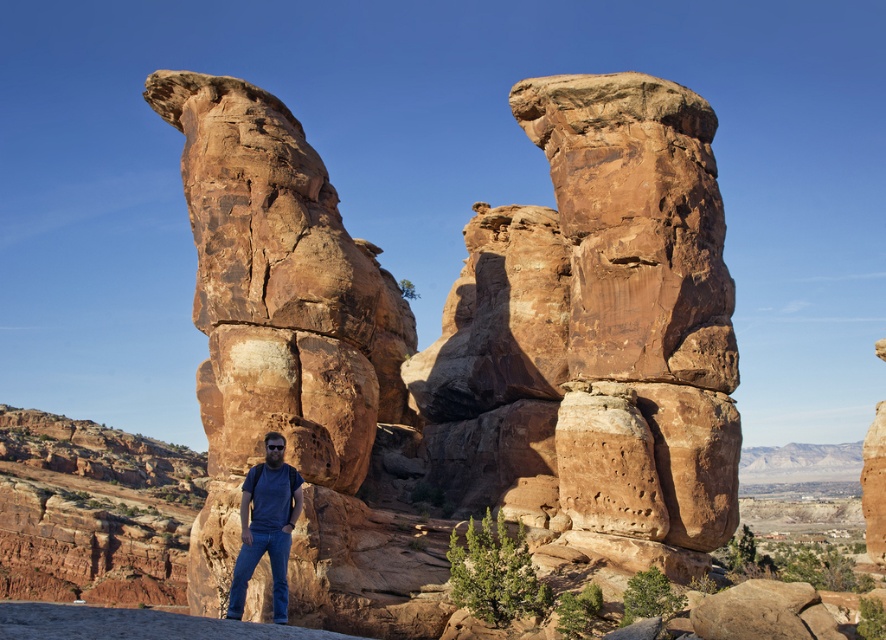
You are a hiker planning to take a photo of the rustic sandstone rock formation at center and denim jeans at lower center. To ensure both are visible in the frame, which object should be closer to the camera?

The denim jeans at lower center should be closer to the camera because the rustic sandstone rock formation at center is positioned over it, meaning the rock formation is farther away.

You are a hiker who wants to take a photo of the rustic sandstone rock formation at center and the denim jeans at lower center. Which object should you focus on first to ensure it appears larger in your photo?

The rustic sandstone rock formation at center is taller than the denim jeans at lower center, so focusing on it first will ensure it appears larger in the photo.